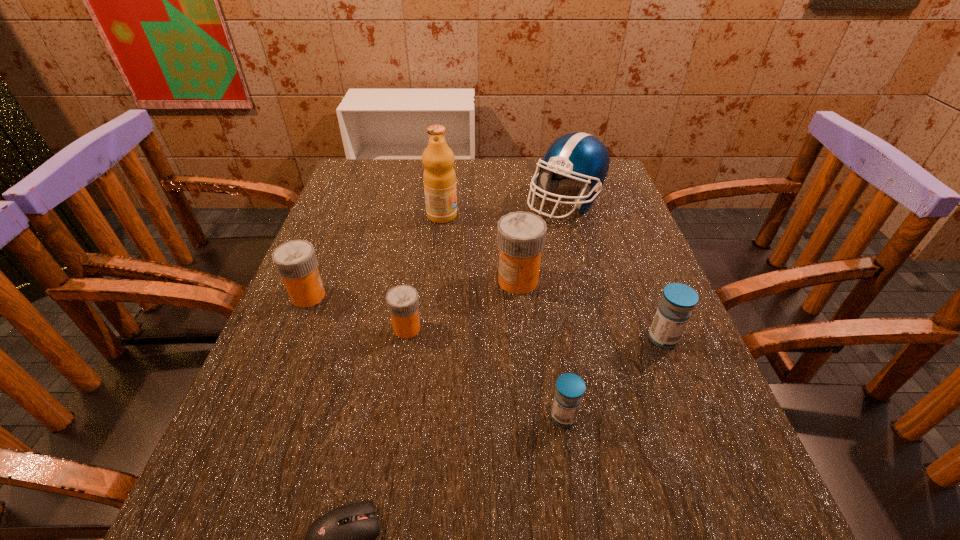
Locate an element on the screen. This screenshot has width=960, height=540. the smallest orange medicine is located at coordinates (402, 301).

The height and width of the screenshot is (540, 960). I want to click on the smaller blue medicine, so click(x=570, y=388).

The width and height of the screenshot is (960, 540). Find the location of `the nearer blue medicine`. the nearer blue medicine is located at coordinates coord(570,388).

The height and width of the screenshot is (540, 960). In order to click on blank area located on the front label of the fruit juice in this screenshot , I will do `click(552, 215)`.

Where is `vacant area situated 0.060m at the front of the football helmet with the faceguard`? This screenshot has width=960, height=540. vacant area situated 0.060m at the front of the football helmet with the faceguard is located at coordinates (576, 242).

Locate an element on the screen. This screenshot has height=540, width=960. blank area located on the label side of the rightmost orange medicine is located at coordinates (393, 281).

Find the location of a particular element. The width and height of the screenshot is (960, 540). free location located 0.210m on the label side of the rightmost orange medicine is located at coordinates (401, 281).

Locate an element on the screen. The height and width of the screenshot is (540, 960). vacant region located 0.400m on the label side of the rightmost orange medicine is located at coordinates (316, 281).

Where is `vacant region located on the label side of the leftmost medicine`? vacant region located on the label side of the leftmost medicine is located at coordinates (514, 296).

This screenshot has width=960, height=540. I want to click on free region located 0.160m on the left of the farther blue medicine, so click(565, 339).